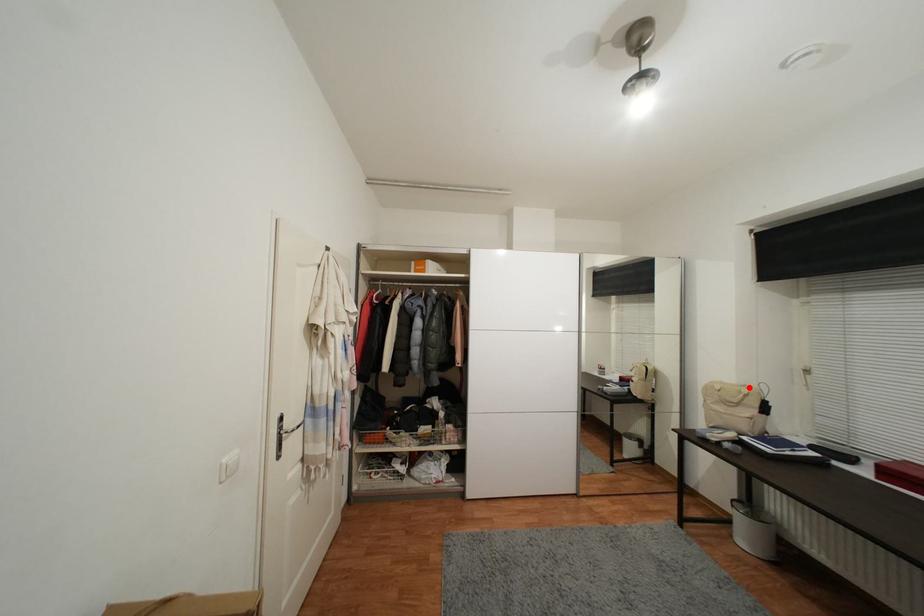
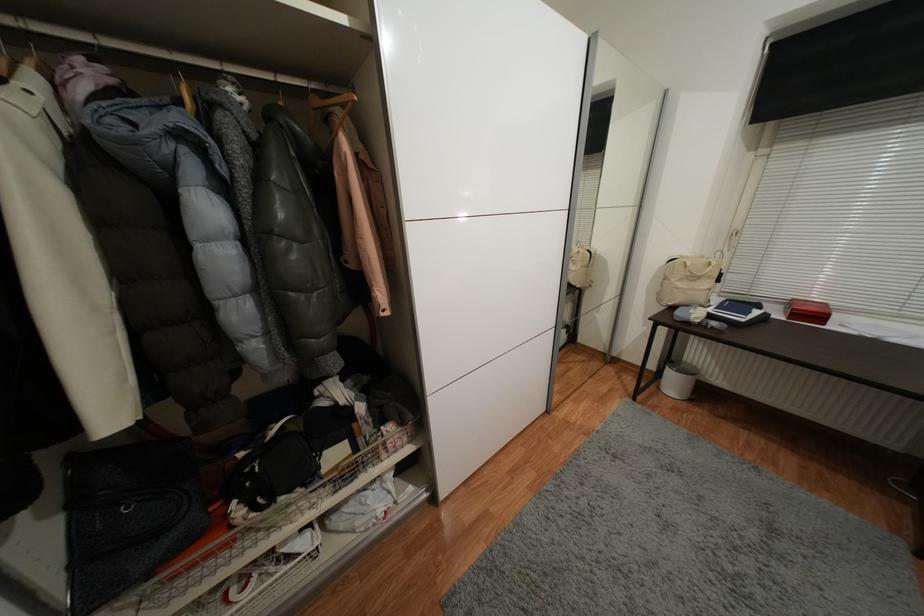
Where in the second image is the point corresponding to the highlighted location from the first image?

(707, 257)